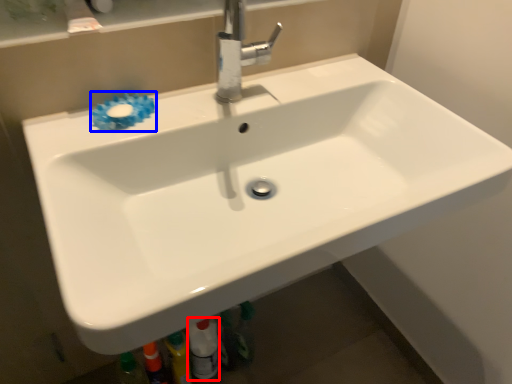
Question: Which object appears closest to the camera in this image, toiletry (highlighted by a red box) or flower (highlighted by a blue box)?

Choices:
 (A) toiletry
 (B) flower

Answer: (B)